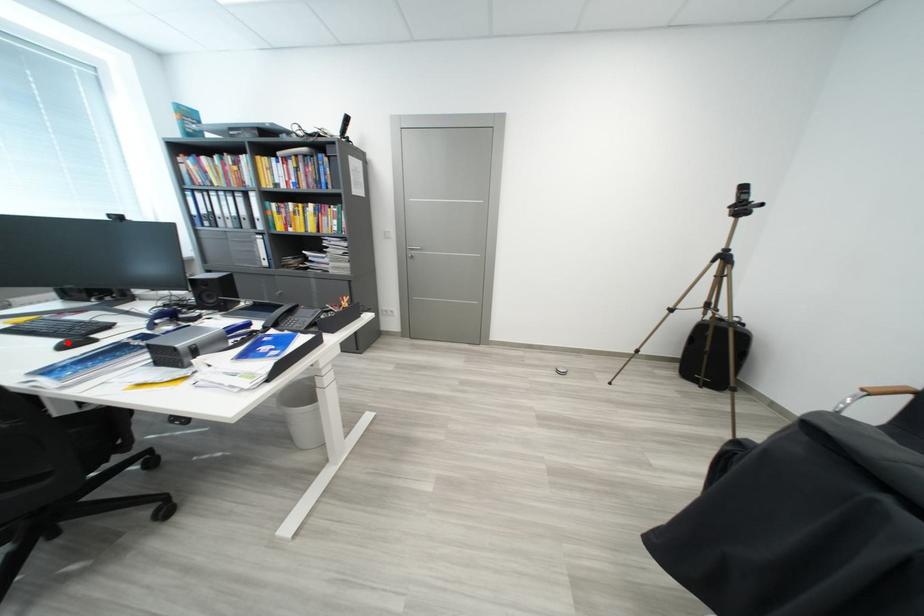
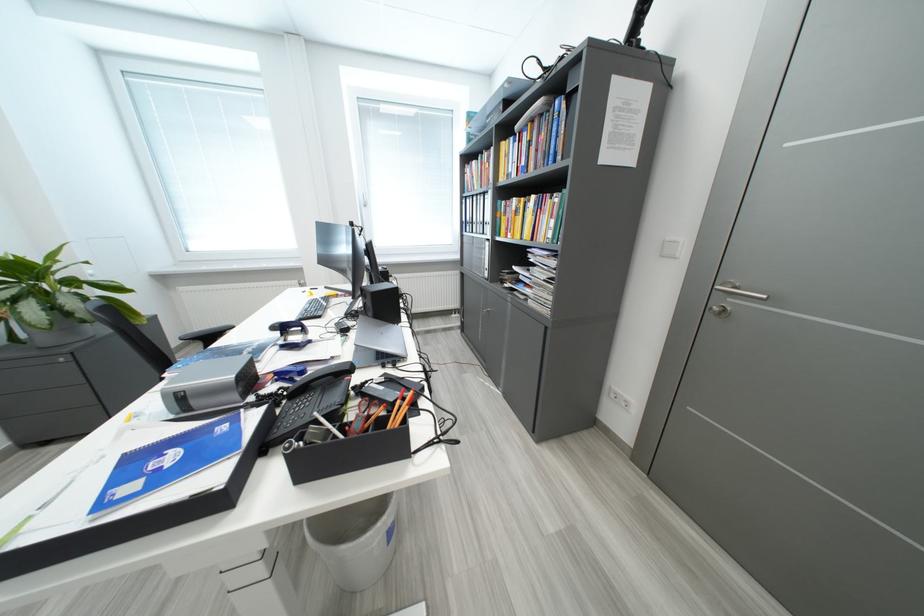
Question: I am providing you with two images of the same scene from different viewpoints. A red point is marked on the first image. Can you still see the location of the red point in image 2?

Choices:
 (A) Yes
 (B) No

Answer: (A)